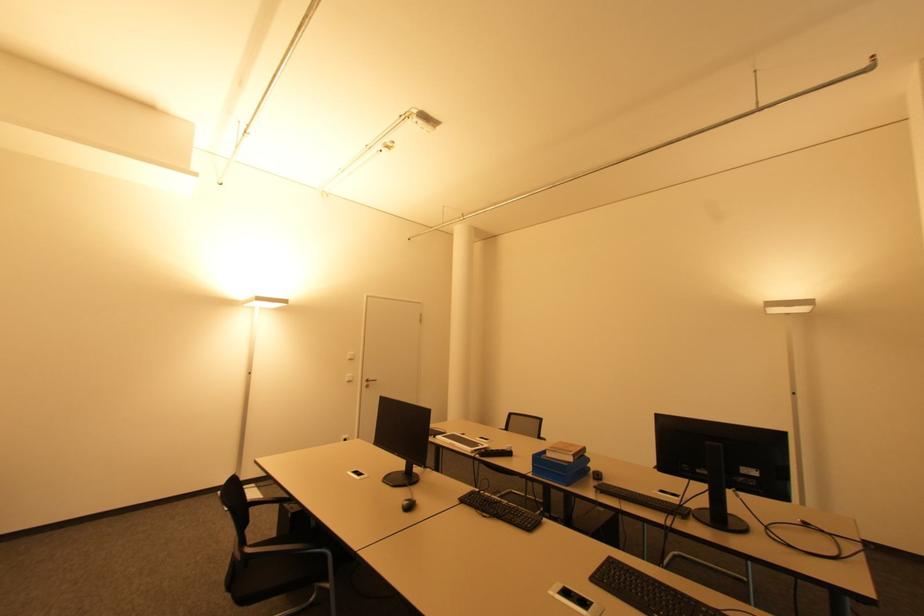
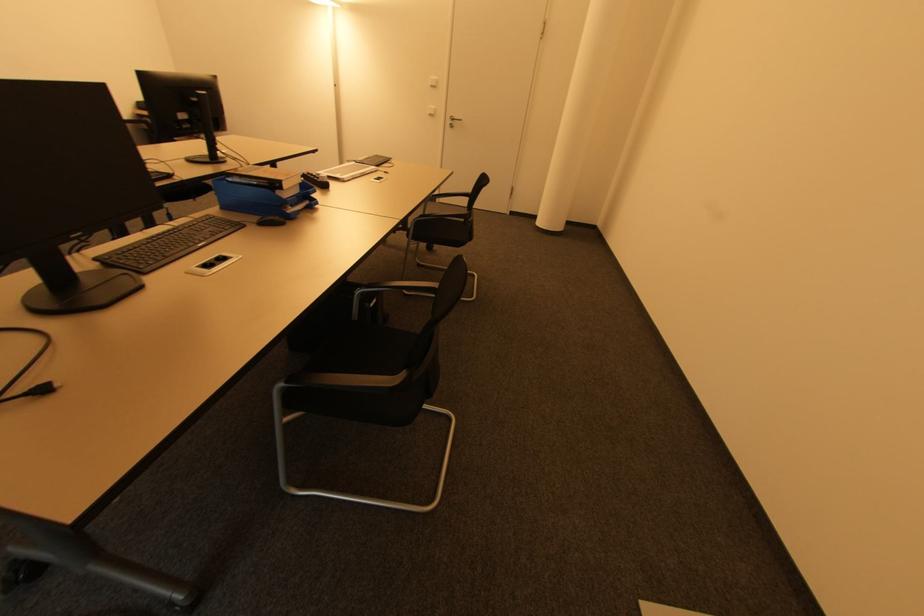
The point at (350, 376) is marked in the first image. Where is the corresponding point in the second image?

(433, 108)